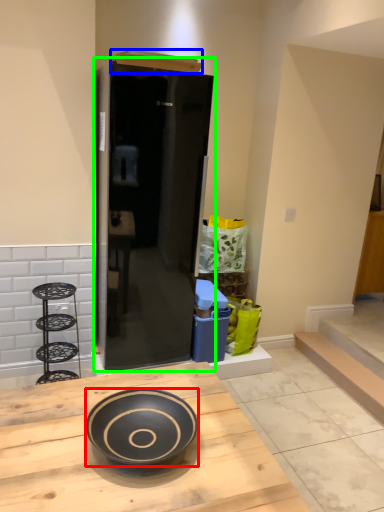
Question: Considering the real-world distances, which object is farthest from bowl (highlighted by a red box)? box (highlighted by a blue box) or door (highlighted by a green box)?

Choices:
 (A) box
 (B) door

Answer: (A)